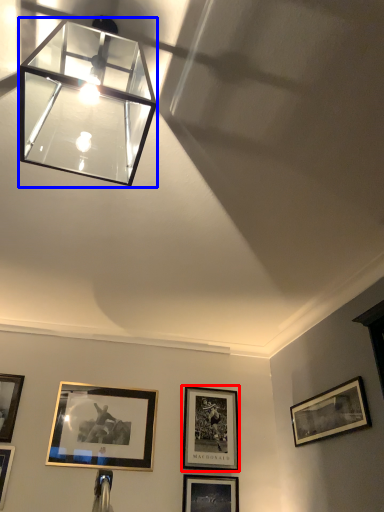
Question: Which point is closer to the camera, picture frame (highlighted by a red box) or lamp (highlighted by a blue box)?

Choices:
 (A) picture frame
 (B) lamp

Answer: (B)